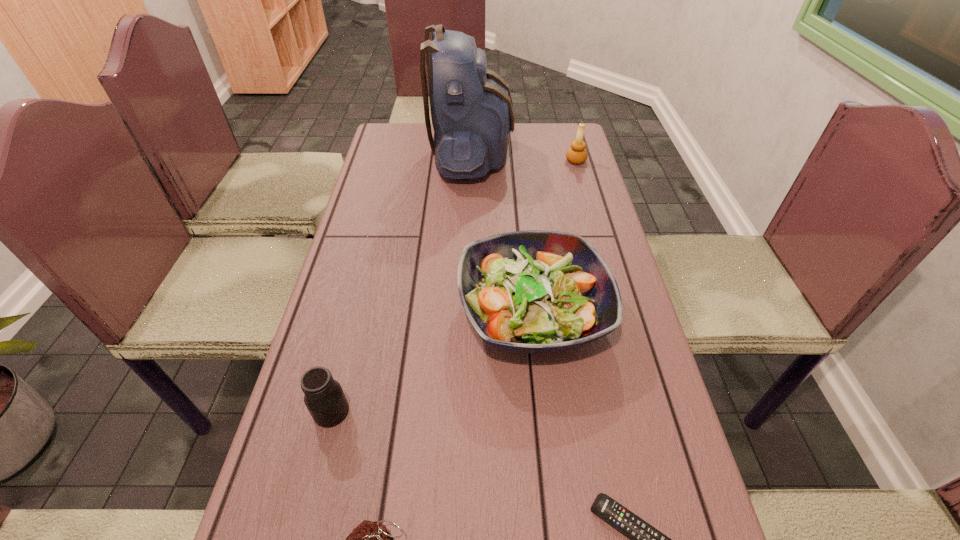
Find the location of a particular element. The image size is (960, 540). object identified as the third closest to the backpack is located at coordinates (324, 398).

Find the location of a particular element. The height and width of the screenshot is (540, 960). free spot that satisfies the following two spatial constraints: 1. on the back side of the salad plate; 2. at the front pocket of the backpack is located at coordinates (516, 155).

Locate an element on the screen. vacant area in the image that satisfies the following two spatial constraints: 1. at the front pocket of the backpack; 2. on the right side of the salad plate is located at coordinates (468, 312).